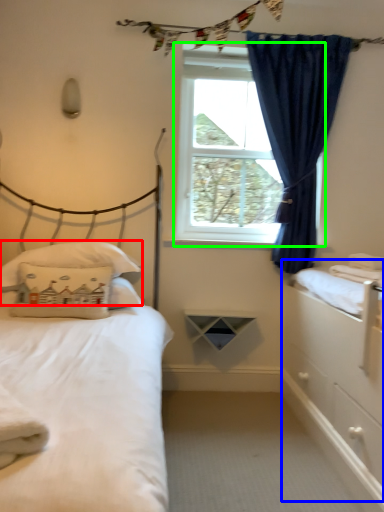
Question: Considering the real-world distances, which object is closest to pillow (highlighted by a red box)? dresser (highlighted by a blue box) or window screen (highlighted by a green box).

Choices:
 (A) dresser
 (B) window screen

Answer: (B)